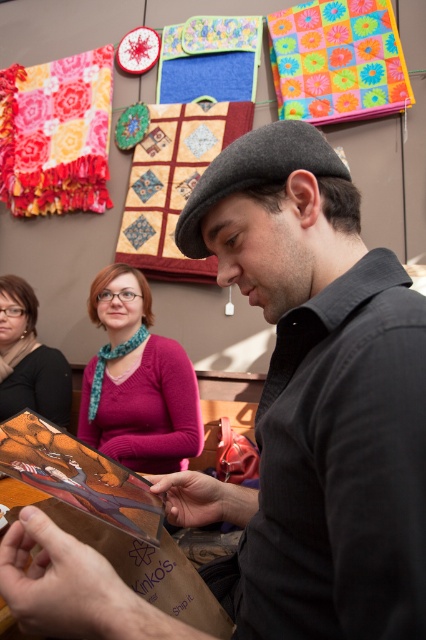
Question: Is gray wool beret at center wider than blue felt pouch at upper center?

Choices:
 (A) no
 (B) yes

Answer: (A)

Question: Based on their relative distances, which object is nearer to the matte pink sweater at center?

Choices:
 (A) pink matte sweater at center
 (B) ruffled fabric quilt at upper left

Answer: (A)

Question: Which object appears closest to the camera in this image?

Choices:
 (A) matte pink sweater at center
 (B) pink matte sweater at center

Answer: (B)

Question: Which object is the farthest from the gray wool beret at center?

Choices:
 (A) blue felt pouch at upper center
 (B) ruffled fabric quilt at upper left

Answer: (B)

Question: Is ruffled fabric quilt at upper left thinner than matte pink sweater at center?

Choices:
 (A) no
 (B) yes

Answer: (A)

Question: Can you confirm if pink matte sweater at center is smaller than quilted fabric at center?

Choices:
 (A) yes
 (B) no

Answer: (A)